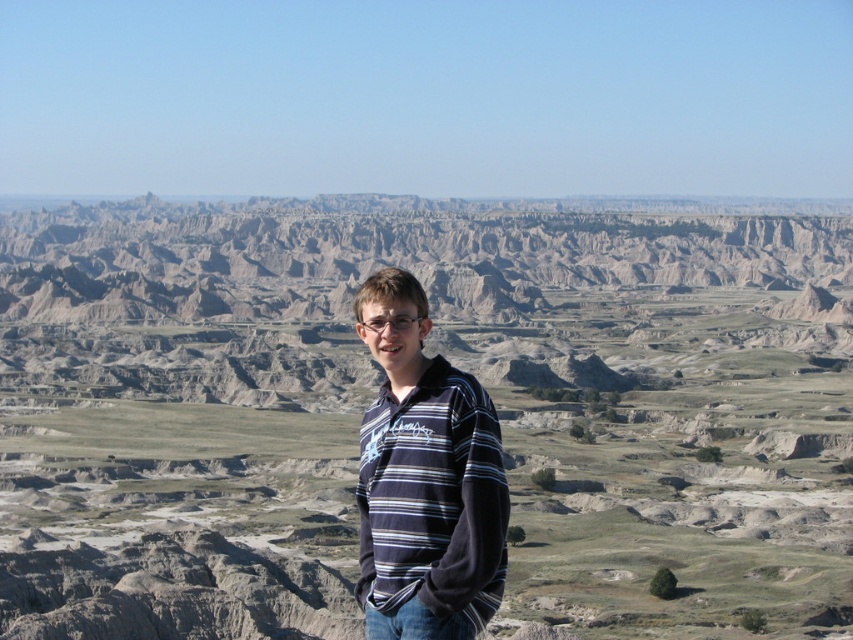
Does gray rock formation at center lie in front of striped cotton shirt at center?

No, it is behind striped cotton shirt at center.

Is point (186, 433) less distant than point (498, 456)?

That is False.

Who is more distant from viewer, [555,275] or [421,628]?

Positioned behind is point [555,275].

This screenshot has height=640, width=853. Identify the location of gray rock formation at center. (378, 387).